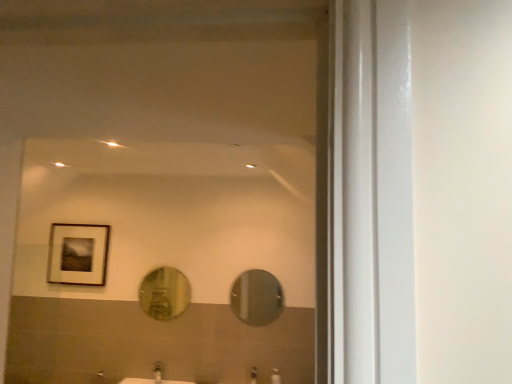
Question: Is shiny metallic mirror at center, arranged as the first mirror when viewed from the right, oriented away from gold textured mirror at center, positioned as the 1th mirror in left-to-right order?

Choices:
 (A) yes
 (B) no

Answer: (B)

Question: Can you confirm if shiny metallic mirror at center, the second mirror when ordered from left to right, is positioned to the right of gold textured mirror at center, positioned as the 1th mirror in left-to-right order?

Choices:
 (A) yes
 (B) no

Answer: (A)

Question: Considering the relative sizes of shiny metallic mirror at center, arranged as the first mirror when viewed from the right, and gold textured mirror at center, positioned as the 1th mirror in left-to-right order, in the image provided, is shiny metallic mirror at center, arranged as the first mirror when viewed from the right, wider than gold textured mirror at center, positioned as the 1th mirror in left-to-right order,?

Choices:
 (A) no
 (B) yes

Answer: (A)

Question: Is shiny metallic mirror at center, the second mirror when ordered from left to right, not inside gold textured mirror at center, the 2th mirror in the right-to-left sequence?

Choices:
 (A) yes
 (B) no

Answer: (A)

Question: Is the position of shiny metallic mirror at center, the second mirror when ordered from left to right, less distant than that of gold textured mirror at center, positioned as the 1th mirror in left-to-right order?

Choices:
 (A) no
 (B) yes

Answer: (B)

Question: Is shiny metallic mirror at center, the second mirror when ordered from left to right, smaller than gold textured mirror at center, positioned as the 1th mirror in left-to-right order?

Choices:
 (A) yes
 (B) no

Answer: (A)

Question: Can you confirm if gold textured mirror at center, positioned as the 1th mirror in left-to-right order, is bigger than wooden framed picture at upper left?

Choices:
 (A) no
 (B) yes

Answer: (A)

Question: Can you confirm if gold textured mirror at center, positioned as the 1th mirror in left-to-right order, is shorter than wooden framed picture at upper left?

Choices:
 (A) no
 (B) yes

Answer: (B)

Question: Is gold textured mirror at center, the 2th mirror in the right-to-left sequence, positioned behind wooden framed picture at upper left?

Choices:
 (A) yes
 (B) no

Answer: (B)

Question: From the image's perspective, is gold textured mirror at center, the 2th mirror in the right-to-left sequence, under wooden framed picture at upper left?

Choices:
 (A) yes
 (B) no

Answer: (A)

Question: Does gold textured mirror at center, the 2th mirror in the right-to-left sequence, have a greater height compared to wooden framed picture at upper left?

Choices:
 (A) yes
 (B) no

Answer: (B)

Question: Does gold textured mirror at center, the 2th mirror in the right-to-left sequence, touch wooden framed picture at upper left?

Choices:
 (A) no
 (B) yes

Answer: (A)

Question: Could matte silver faucet at lower center, the 1th faucet from the left, be considered to be inside gold textured mirror at center, the 2th mirror in the right-to-left sequence?

Choices:
 (A) yes
 (B) no

Answer: (B)